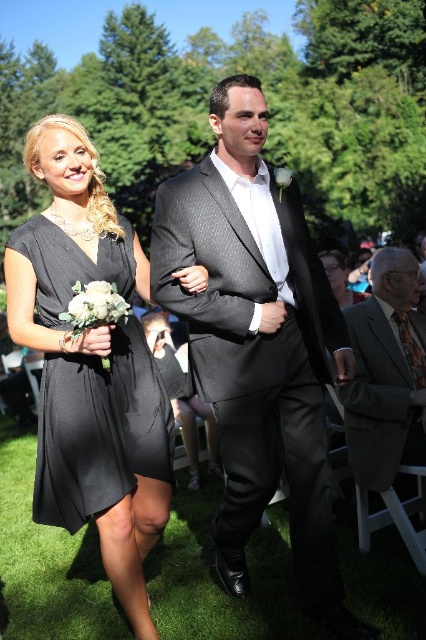
You are a photographer at a wedding and need to capture a photo of the two brides wearing the black satin dress at center and the matte black dress at lower center. Since you want to ensure both are clearly visible, which bride should you focus on first?

The black satin dress at center is in front of the matte black dress at lower center, so you should focus on the black satin dress at center first to ensure it is in clear focus while the matte black dress at lower center remains visible in the background.

Based on the photo, you are a photographer at a wedding and need to position two guests for a group photo. You have to place the black satin dress at center and the matte black dress at lower center. Considering their widths, which dress should you give more space to on the right side?

The black satin dress at center might be wider than the matte black dress at lower center, so you should give more space to the black satin dress at center on the right side to accommodate its width.